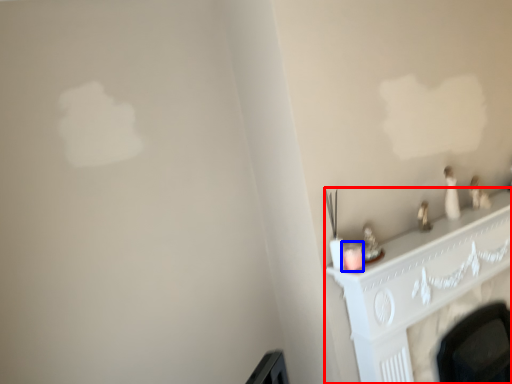
Question: Which of the following is the farthest to the observer, fireplace (highlighted by a red box) or candle holder (highlighted by a blue box)?

Choices:
 (A) fireplace
 (B) candle holder

Answer: (A)